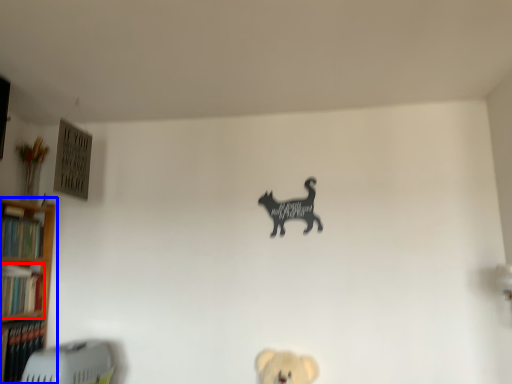
Question: Among these objects, which one is nearest to the camera, book (highlighted by a red box) or shelf (highlighted by a blue box)?

Choices:
 (A) book
 (B) shelf

Answer: (B)